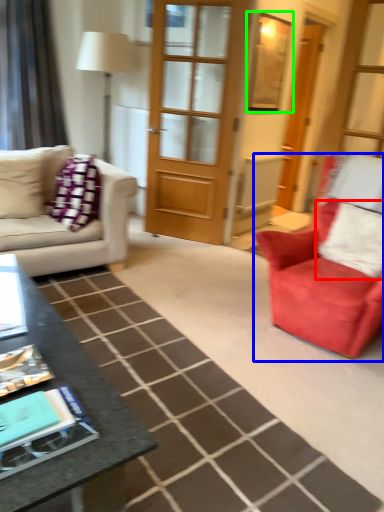
Question: Considering the real-world distances, which object is closest to pillow (highlighted by a red box)? chair (highlighted by a blue box) or window screen (highlighted by a green box).

Choices:
 (A) chair
 (B) window screen

Answer: (A)